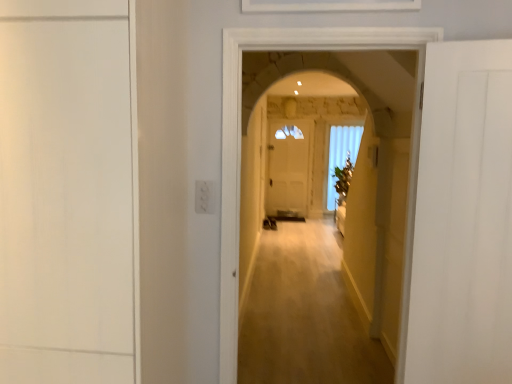
What do you see at coordinates (241, 140) in the screenshot?
I see `wooden floor at center` at bounding box center [241, 140].

In the scene shown: In order to face white matte door at left, acting as the second door starting from the right, should I rotate leftwards or rightwards?

To face it directly, rotate left by 26.128 degrees.

What is the approximate height of white matte door at left, the 1th door from the left?

1.76 meters.

The height and width of the screenshot is (384, 512). I want to click on white matte door at right, the second door from the left, so click(x=463, y=219).

Where is `wooden floor at center`? wooden floor at center is located at coordinates (241, 140).

Looking at this image, from the image's perspective, is white matte door at right, acting as the 1th door starting from the right, on top of white glass window at center?

Incorrect, from the image's perspective, white matte door at right, acting as the 1th door starting from the right, is lower than white glass window at center.

Can you confirm if white matte door at right, acting as the 1th door starting from the right, is thinner than white glass window at center?

No, white matte door at right, acting as the 1th door starting from the right, is not thinner than white glass window at center.

Are white matte door at right, acting as the 1th door starting from the right, and white glass window at center located far from each other?

Yes, white matte door at right, acting as the 1th door starting from the right, and white glass window at center are quite far apart.

Measure the distance from white matte door at right, the second door from the left, to white glass window at center.

6.18 meters.

Could you tell me if white glass window at center is turned towards white matte door at left, acting as the second door starting from the right?

No, white glass window at center is not oriented towards white matte door at left, acting as the second door starting from the right.

Would you say white glass window at center contains white matte door at left, the 1th door from the left?

No, white matte door at left, the 1th door from the left, is not inside white glass window at center.

Considering the relative positions of white glass window at center and white matte door at left, acting as the second door starting from the right, in the image provided, is white glass window at center in front of white matte door at left, acting as the second door starting from the right,?

No, white glass window at center is behind white matte door at left, acting as the second door starting from the right.

From the image's perspective, between wooden floor at center and white glass window at center, who is located below?

wooden floor at center.

Can you confirm if wooden floor at center is wider than white glass window at center?

Yes.

Are wooden floor at center and white glass window at center located far from each other?

Absolutely, wooden floor at center is distant from white glass window at center.

Which object is closer to the camera taking this photo, wooden floor at center or white glass window at center?

wooden floor at center is closer to the camera.

Who is taller, white matte door at left, the 1th door from the left, or white matte door at right, the second door from the left?

white matte door at left, the 1th door from the left, is taller.

The width and height of the screenshot is (512, 384). In order to click on door directly beneath the white matte door at left, acting as the second door starting from the right (from a real-world perspective) in this screenshot , I will do (463, 219).

How many degrees apart are the facing directions of white matte door at left, the 1th door from the left, and white matte door at right, the second door from the left?

The angle between the facing direction of white matte door at left, the 1th door from the left, and the facing direction of white matte door at right, the second door from the left, is 17.4 degrees.

Is white matte door at left, acting as the second door starting from the right, facing towards white matte door at right, acting as the 1th door starting from the right?

No, white matte door at left, acting as the second door starting from the right, is not oriented towards white matte door at right, acting as the 1th door starting from the right.

In the scene shown: Which is correct: wooden floor at center is inside white matte door at left, acting as the second door starting from the right, or outside of it?

wooden floor at center is outside white matte door at left, acting as the second door starting from the right.

Which point is more forward, (275, 47) or (89, 39)?

Point (89, 39)

In the image, is wooden floor at center on the left side or the right side of white matte door at left, the 1th door from the left?

In the image, wooden floor at center appears on the right side of white matte door at left, the 1th door from the left.

Locate an element on the screen. This screenshot has width=512, height=384. corridor that is under the white matte door at left, acting as the second door starting from the right (from a real-world perspective) is located at coordinates (241, 140).

Considering the relative sizes of wooden floor at center and white matte door at right, the second door from the left, in the image provided, is wooden floor at center shorter than white matte door at right, the second door from the left,?

In fact, wooden floor at center may be taller than white matte door at right, the second door from the left.

Which object is positioned more to the right, wooden floor at center or white matte door at right, the second door from the left?

white matte door at right, the second door from the left.

Does wooden floor at center touch white matte door at right, acting as the 1th door starting from the right?

wooden floor at center is not next to white matte door at right, acting as the 1th door starting from the right, and they're not touching.

How far apart are wooden floor at center and white matte door at right, acting as the 1th door starting from the right?

11.88 inches.

Is white matte door at right, the second door from the left, to the right of wooden floor at center from the viewer's perspective?

Indeed, white matte door at right, the second door from the left, is positioned on the right side of wooden floor at center.

Which is correct: white matte door at right, the second door from the left, is inside wooden floor at center, or outside of it?

white matte door at right, the second door from the left, is spatially situated outside wooden floor at center.

Between white matte door at right, the second door from the left, and wooden floor at center, which one has larger size?

With larger size is wooden floor at center.

From a real-world perspective, is white matte door at right, acting as the 1th door starting from the right, physically located above or below wooden floor at center?

In terms of real-world spatial position, white matte door at right, acting as the 1th door starting from the right, is above wooden floor at center.

At what (x,y) coordinates should I click in order to perform the action: click on window above the white matte door at right, the second door from the left (from the image's perspective). Please return your answer as a coordinate pair (x, y). Looking at the image, I should click on (341, 154).

The width and height of the screenshot is (512, 384). What are the coordinates of `window located behind the white matte door at left, acting as the second door starting from the right` in the screenshot? It's located at (341, 154).

Considering their positions, is white glass window at center positioned closer to white matte door at right, the second door from the left, than white matte door at left, the 1th door from the left?

white matte door at left, the 1th door from the left, is closer to white matte door at right, the second door from the left.

Which object lies nearer to the anchor point white matte door at left, acting as the second door starting from the right, wooden floor at center or white glass window at center?

wooden floor at center.

Estimate the real-world distances between objects in this image. Which object is further from white glass window at center, wooden floor at center or white matte door at left, the 1th door from the left?

Based on the image, white matte door at left, the 1th door from the left, appears to be further to white glass window at center.

In the scene shown: From the image, which object appears to be nearer to white glass window at center, white matte door at left, the 1th door from the left, or wooden floor at center?

Among the two, wooden floor at center is located nearer to white glass window at center.

Looking at the image, which one is located further to white glass window at center, wooden floor at center or white matte door at right, the second door from the left?

Based on the image, white matte door at right, the second door from the left, appears to be further to white glass window at center.

From the picture: Which object lies nearer to the anchor point white matte door at right, acting as the 1th door starting from the right, wooden floor at center or white matte door at left, the 1th door from the left?

wooden floor at center is positioned closer to the anchor white matte door at right, acting as the 1th door starting from the right.

Which object lies nearer to the anchor point white matte door at left, acting as the second door starting from the right, white glass window at center or white matte door at right, the second door from the left?

white matte door at right, the second door from the left, is positioned closer to the anchor white matte door at left, acting as the second door starting from the right.

Estimate the real-world distances between objects in this image. Which object is further from wooden floor at center, white matte door at left, the 1th door from the left, or white glass window at center?

white glass window at center.

In order to click on corridor located between white matte door at left, the 1th door from the left, and white glass window at center in the depth direction in this screenshot , I will do `click(241, 140)`.

Locate an element on the screen. The width and height of the screenshot is (512, 384). door between white matte door at left, the 1th door from the left, and white glass window at center, along the z-axis is located at coordinates (463, 219).

This screenshot has height=384, width=512. I want to click on corridor situated between white matte door at left, the 1th door from the left, and white matte door at right, the second door from the left, from left to right, so click(241, 140).

You are a GUI agent. You are given a task and a screenshot of the screen. Output one action in this format:
    pyautogui.click(x=<x>, y=<y>)
    Task: Click on the corridor between white matte door at right, the second door from the left, and white glass window at center in the front-back direction
    
    Given the screenshot: What is the action you would take?
    pyautogui.click(x=241, y=140)